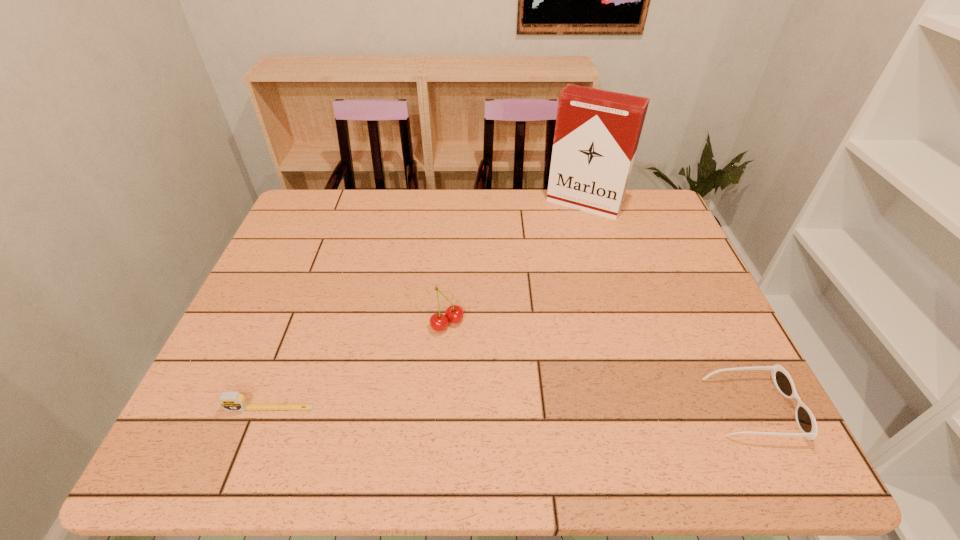
Identify the location of tape measure. Image resolution: width=960 pixels, height=540 pixels. (230, 401).

At what (x,y) coordinates should I click in order to perform the action: click on sunglasses. Please return your answer as a coordinate pair (x, y). Looking at the image, I should click on (806, 422).

Image resolution: width=960 pixels, height=540 pixels. I want to click on the third object from left to right, so click(x=597, y=132).

Where is `the farthest object`? the farthest object is located at coordinates (597, 132).

Locate an element on the screen. the third shortest object is located at coordinates (454, 313).

Identify the location of the second farthest object. Image resolution: width=960 pixels, height=540 pixels. (454, 313).

Image resolution: width=960 pixels, height=540 pixels. I want to click on free region located on the front-facing side of the second object from right to left, so click(x=537, y=274).

What are the coordinates of `vacant region located 0.320m on the front-facing side of the second object from right to left` in the screenshot? It's located at (533, 281).

Locate an element on the screen. The width and height of the screenshot is (960, 540). vacant space located on the front-facing side of the second object from right to left is located at coordinates (563, 232).

The image size is (960, 540). I want to click on vacant position located 0.100m with the stems of the third shortest object pointing upwards, so click(x=482, y=360).